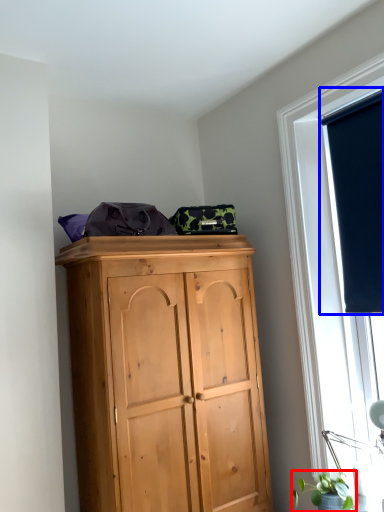
Question: Which of the following is the farthest to the observer, plant (highlighted by a red box) or window screen (highlighted by a blue box)?

Choices:
 (A) plant
 (B) window screen

Answer: (B)